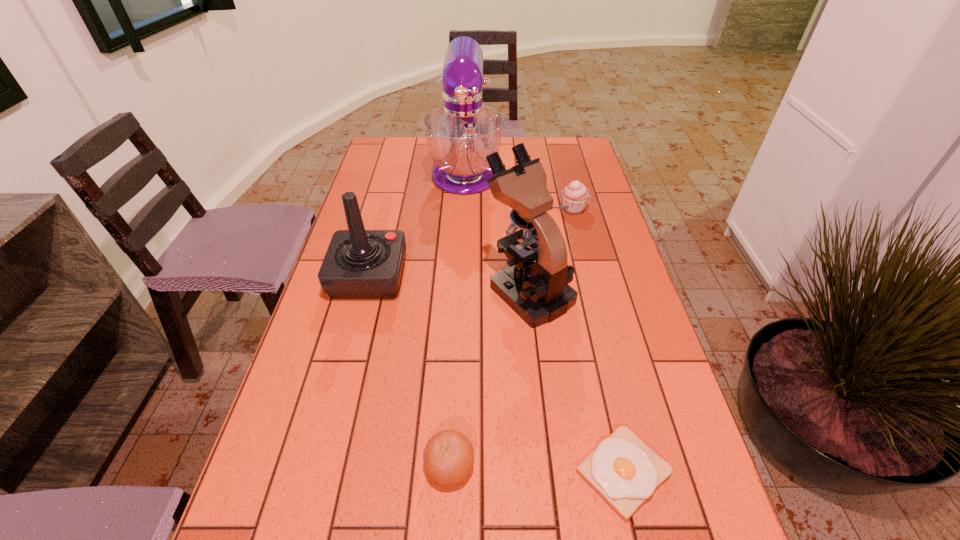
What are the coordinates of `free space that satisfies the following two spatial constraints: 1. on the front-facing side of the leftmost object; 2. on the back side of the shortest object` in the screenshot? It's located at (317, 472).